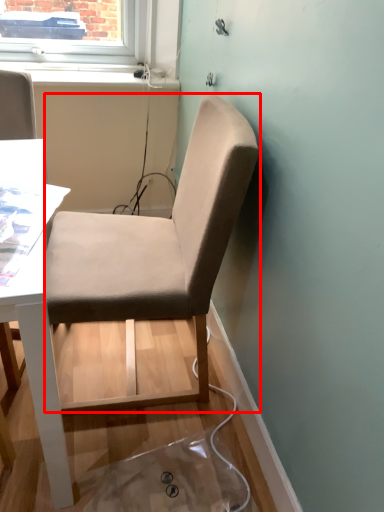
Question: Considering the relative positions of chair (annotated by the red box) and window sill in the image provided, where is chair (annotated by the red box) located with respect to the staircase?

Choices:
 (A) right
 (B) left

Answer: (A)